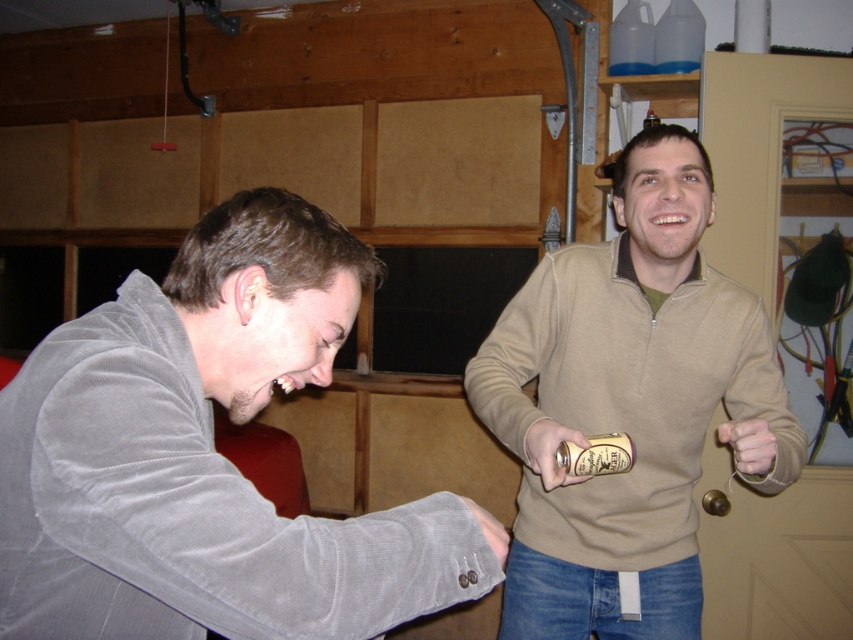
Question: Estimate the real-world distances between objects in this image. Which object is farther from the matte beige hand at lower right?

Choices:
 (A) beige fleece sweater at upper right
 (B) velvet gray jacket at left
 (C) metallic gold can at right
 (D) gray corduroy hand at lower left

Answer: (B)

Question: Which point is closer to the camera?

Choices:
 (A) (283, 576)
 (B) (740, 433)
 (C) (698, 403)

Answer: (A)

Question: Is beige fleece sweater at upper right further to camera compared to gray corduroy hand at lower left?

Choices:
 (A) yes
 (B) no

Answer: (A)

Question: Which of the following is the farthest from the observer?

Choices:
 (A) (527, 442)
 (B) (276, 332)
 (C) (766, 449)

Answer: (A)

Question: Is matte beige hand at lower right to the right of gray corduroy hand at lower left from the viewer's perspective?

Choices:
 (A) no
 (B) yes

Answer: (B)

Question: Observing the image, what is the correct spatial positioning of matte beige hand at lower right in reference to gray corduroy hand at lower left?

Choices:
 (A) left
 (B) right

Answer: (B)